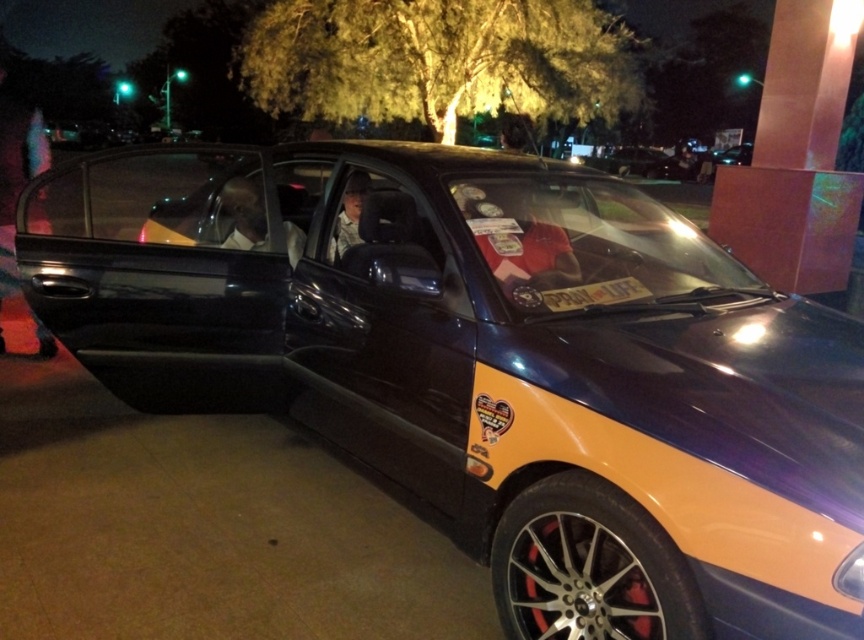
You are standing at the point marked by coordinates point (16, 177), which is located on the matte black car door at left. If you look straight ahead, will you see the open door of the taxi?

The point marked by coordinates point (16, 177) is located on the matte black car door at left. Since the taxi has an open door, looking straight ahead from this point would allow you to see the open door of the taxi.

You are a passenger in the taxi and notice two shirts inside the vehicle. The driver is wearing the matte black shirt at center, and there is another matte red shirt at center hanging on the passenger seat. Which shirt is closer to the driver?

The matte red shirt at center is to the right of the matte black shirt at center, so the matte red shirt at center is closer to the driver since it is positioned to the right side of the driver.

You are a passenger in a taxi at night. You notice two shirts inside the taxi. The first is a matte red shirt at center and the second is a matte black shirt at center. Which shirt is positioned lower in the driver seat?

The matte red shirt at center is located below the matte black shirt at center, so the matte red shirt at center is positioned lower in the driver seat.